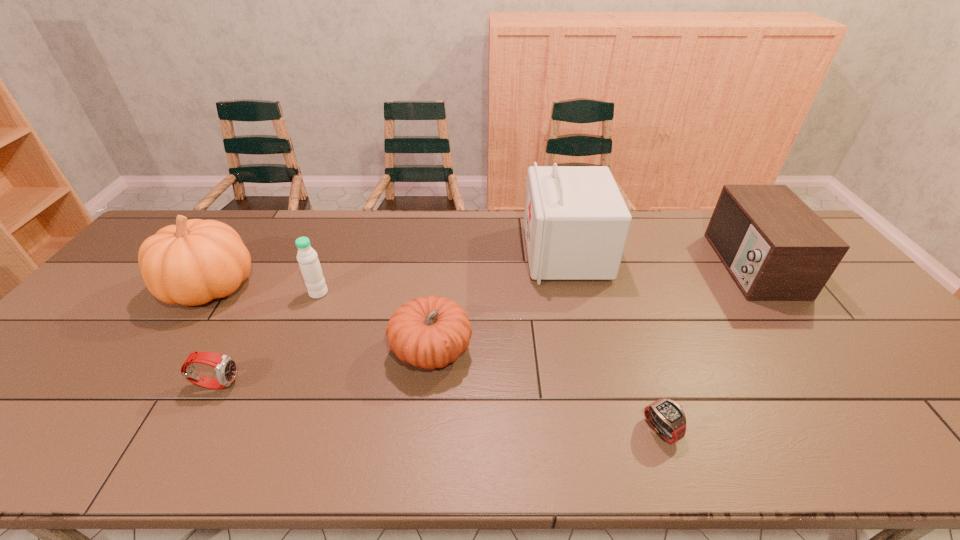
The height and width of the screenshot is (540, 960). In order to click on vacant space that's between the left watch and the second tallest object in this screenshot , I will do `click(214, 335)`.

The image size is (960, 540). I want to click on free spot between the first-aid kit and the right watch, so click(613, 341).

Locate which object ranks fifth in proximity to the shorter pumpkin. Please provide its 2D coordinates. Your answer should be formatted as a tuple, i.e. [(x, y)], where the tuple contains the x and y coordinates of a point satisfying the conditions above.

[(191, 263)]

This screenshot has width=960, height=540. What are the coordinates of `object that ranks as the third closest to the first-aid kit` in the screenshot? It's located at (667, 417).

Locate an element on the screen. The image size is (960, 540). blank area in the image that satisfies the following two spatial constraints: 1. on the front side of the right watch; 2. on the left side of the farther pumpkin is located at coordinates (114, 430).

Where is `vacant space that satisfies the following two spatial constraints: 1. on the front side of the left pumpkin; 2. on the right side of the water bottle`? vacant space that satisfies the following two spatial constraints: 1. on the front side of the left pumpkin; 2. on the right side of the water bottle is located at coordinates (207, 293).